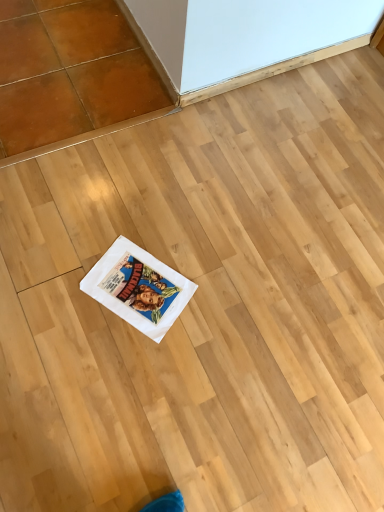
This screenshot has height=512, width=384. What are the coordinates of `free spot in front of white paper comic book at center` in the screenshot? It's located at (119, 362).